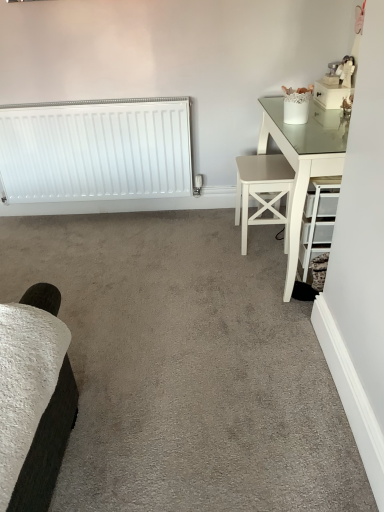
Question: Is white wood stool at right next to white matte radiator at left and touching it?

Choices:
 (A) no
 (B) yes

Answer: (A)

Question: Could you tell me if white wood stool at right is facing white matte radiator at left?

Choices:
 (A) no
 (B) yes

Answer: (A)

Question: Can you confirm if white wood stool at right is thinner than white matte radiator at left?

Choices:
 (A) yes
 (B) no

Answer: (B)

Question: From the image's perspective, is white wood stool at right located above white matte radiator at left?

Choices:
 (A) yes
 (B) no

Answer: (B)

Question: Is white wood stool at right taller than white matte radiator at left?

Choices:
 (A) yes
 (B) no

Answer: (B)

Question: Considering the relative sizes of white wood stool at right and white matte radiator at left in the image provided, is white wood stool at right smaller than white matte radiator at left?

Choices:
 (A) no
 (B) yes

Answer: (B)

Question: Does white matte radiator at left lie in front of white wood stool at right?

Choices:
 (A) no
 (B) yes

Answer: (A)

Question: Considering the relative sizes of white matte radiator at left and white wood stool at right in the image provided, is white matte radiator at left shorter than white wood stool at right?

Choices:
 (A) no
 (B) yes

Answer: (A)

Question: Is white matte radiator at left next to white wood stool at right?

Choices:
 (A) no
 (B) yes

Answer: (A)

Question: From a real-world perspective, is white matte radiator at left below white wood stool at right?

Choices:
 (A) no
 (B) yes

Answer: (A)

Question: From the image's perspective, is white matte radiator at left under white wood stool at right?

Choices:
 (A) no
 (B) yes

Answer: (A)

Question: From a real-world perspective, is white matte radiator at left over white wood stool at right?

Choices:
 (A) yes
 (B) no

Answer: (A)

Question: From a real-world perspective, is white wood stool at right physically located above or below white matte radiator at left?

Choices:
 (A) above
 (B) below

Answer: (B)